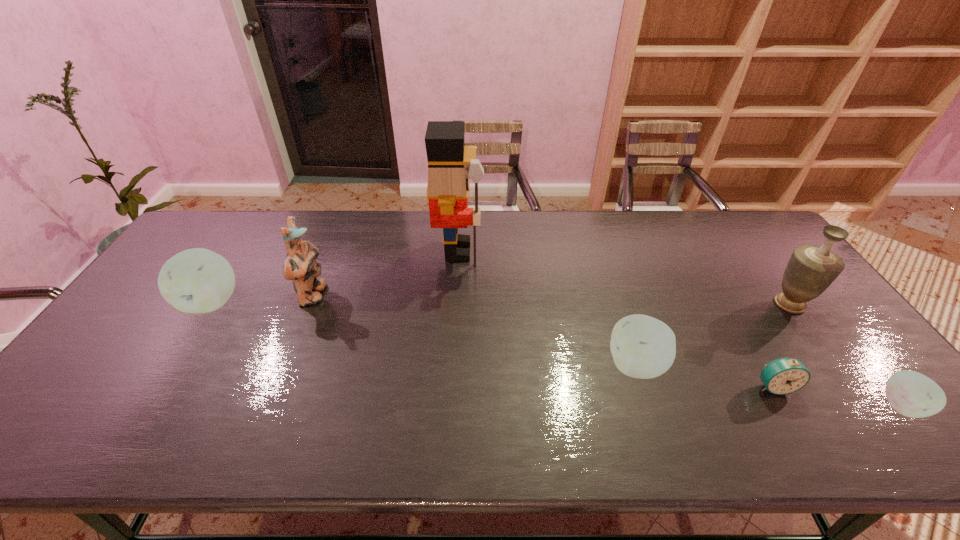
This screenshot has height=540, width=960. What are the coordinates of `the closest apple to the fifth object from left to right` in the screenshot? It's located at (912, 394).

Locate an element on the screen. This screenshot has width=960, height=540. apple that is the nearest to the urn is located at coordinates (912, 394).

Where is `free spot that satisfies the following two spatial constraints: 1. on the front-facing side of the shortest apple; 2. on the left side of the sixth object from right to left`? free spot that satisfies the following two spatial constraints: 1. on the front-facing side of the shortest apple; 2. on the left side of the sixth object from right to left is located at coordinates (269, 406).

Where is `free space in the image that satisfies the following two spatial constraints: 1. in front of the rightmost apple holding the staff; 2. on the left side of the nutcracker`? Image resolution: width=960 pixels, height=540 pixels. free space in the image that satisfies the following two spatial constraints: 1. in front of the rightmost apple holding the staff; 2. on the left side of the nutcracker is located at coordinates (449, 406).

At what (x,y) coordinates should I click in order to perform the action: click on vacant area in the image that satisfies the following two spatial constraints: 1. on the front side of the fourth object from left to right; 2. on the left side of the shortest apple. Please return your answer as a coordinate pair (x, y). Looking at the image, I should click on (649, 406).